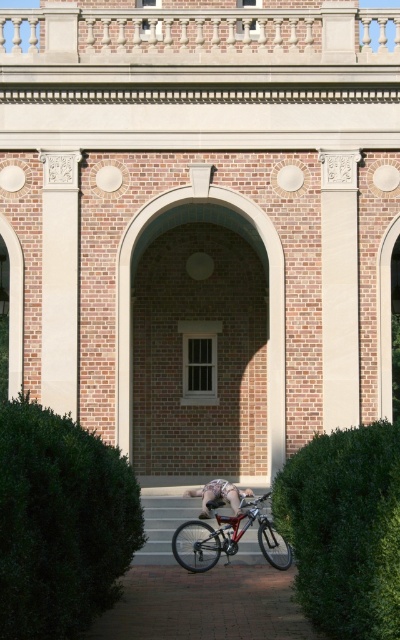
Question: Does green leafy hedge at lower right have a greater width compared to skinny jeans at center?

Choices:
 (A) yes
 (B) no

Answer: (A)

Question: Does green leafy hedge at lower right have a greater width compared to shiny metallic bicycle at center?

Choices:
 (A) no
 (B) yes

Answer: (A)

Question: Estimate the real-world distances between objects in this image. Which object is farther from the skinny jeans at center?

Choices:
 (A) green leafy hedge at lower right
 (B) green leafy hedge at lower left
 (C) shiny metallic bicycle at center

Answer: (B)

Question: Which of the following is the closest to the observer?

Choices:
 (A) green leafy hedge at lower right
 (B) green leafy hedge at lower left
 (C) shiny metallic bicycle at center
 (D) skinny jeans at center

Answer: (B)

Question: In this image, where is green leafy hedge at lower left located relative to shiny metallic bicycle at center?

Choices:
 (A) above
 (B) below

Answer: (A)

Question: Considering the real-world distances, which object is farthest from the green leafy hedge at lower right?

Choices:
 (A) green leafy hedge at lower left
 (B) skinny jeans at center

Answer: (B)